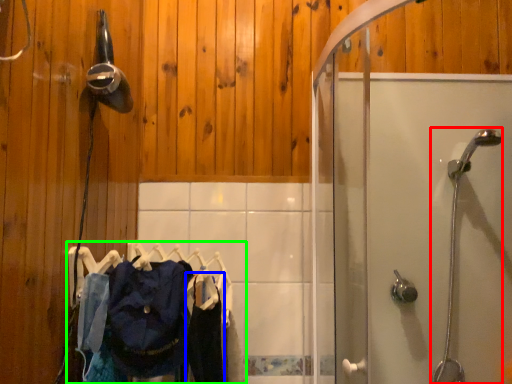
Question: Considering the real-world distances, which object is farthest from shower (highlighted by a red box)? clothing (highlighted by a blue box) or laundry (highlighted by a green box)?

Choices:
 (A) clothing
 (B) laundry

Answer: (B)